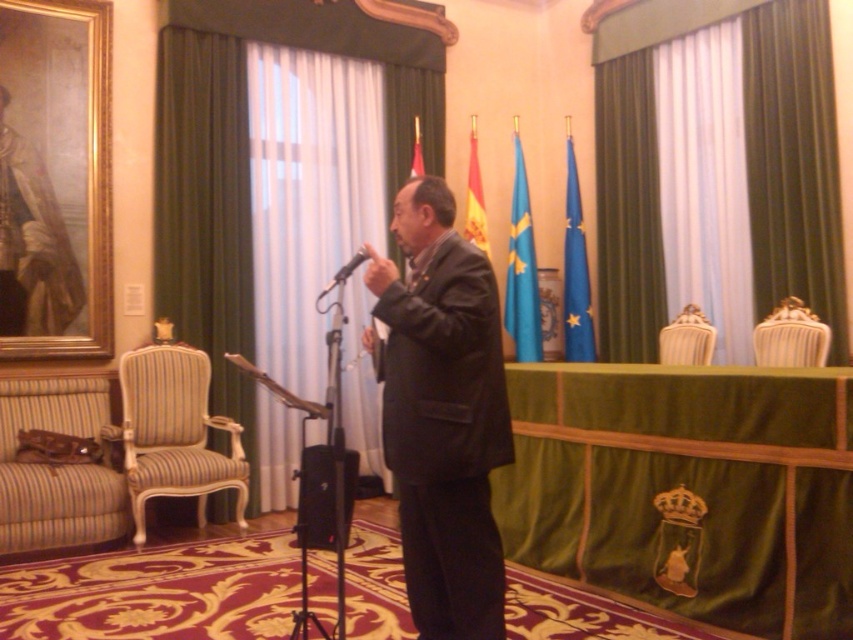
Question: Which is nearer to the striped fabric armchair at lower left?

Choices:
 (A) black matte suit at center
 (B) black matte speaker at center
 (C) black matte microphone at center

Answer: (C)

Question: Which of the following is the closest to the observer?

Choices:
 (A) striped fabric armchair at lower left
 (B) black matte speaker at center
 (C) blue fabric flag at center
 (D) black matte suit at center

Answer: (D)

Question: Does blue fabric flag at center appear over striped fabric armchair at right?

Choices:
 (A) no
 (B) yes

Answer: (B)

Question: Which object appears closest to the camera in this image?

Choices:
 (A) striped fabric armchair at left
 (B) light beige wood armchair at right
 (C) striped fabric armchair at lower left
 (D) matte red flag at center

Answer: (C)

Question: Is blue fabric flag at upper center bigger than matte red flag at center?

Choices:
 (A) no
 (B) yes

Answer: (A)

Question: Can you confirm if striped fabric armchair at left is thinner than black matte speaker at center?

Choices:
 (A) yes
 (B) no

Answer: (B)